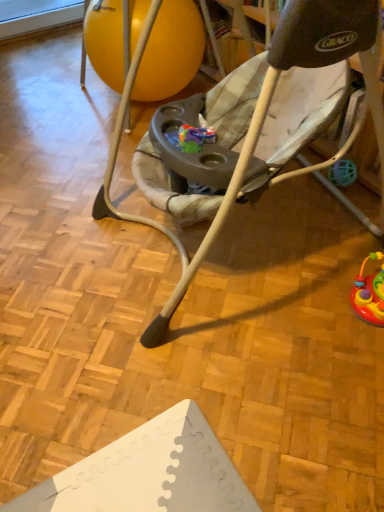
Question: From their relative heights in the image, would you say gray fabric baby swing at center is taller or shorter than rubberized yellow ball at center?

Choices:
 (A) short
 (B) tall

Answer: (B)

Question: From a real-world perspective, relative to rubberized yellow ball at center, is gray fabric baby swing at center vertically above or below?

Choices:
 (A) below
 (B) above

Answer: (B)

Question: Considering the positions of gray fabric baby swing at center and rubberized yellow ball at center in the image, is gray fabric baby swing at center wider or thinner than rubberized yellow ball at center?

Choices:
 (A) wide
 (B) thin

Answer: (A)

Question: From the image's perspective, is rubberized yellow ball at center located above or below gray fabric baby swing at center?

Choices:
 (A) below
 (B) above

Answer: (B)

Question: Visually, is rubberized yellow ball at center positioned to the left or to the right of gray fabric baby swing at center?

Choices:
 (A) right
 (B) left

Answer: (B)

Question: In terms of size, does rubberized yellow ball at center appear bigger or smaller than gray fabric baby swing at center?

Choices:
 (A) big
 (B) small

Answer: (B)

Question: From a real-world perspective, relative to gray fabric baby swing at center, is rubberized yellow ball at center vertically above or below?

Choices:
 (A) below
 (B) above

Answer: (A)